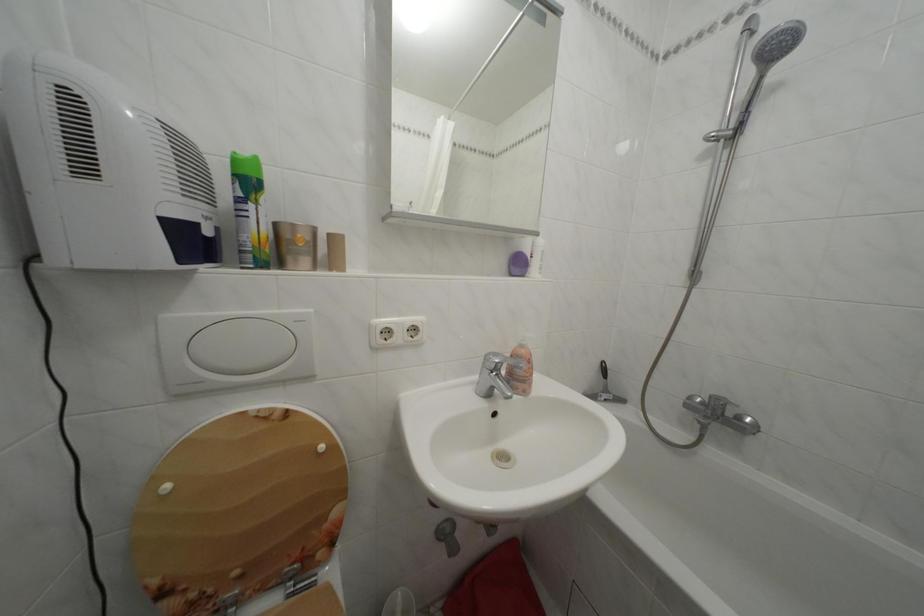
The image size is (924, 616). Identify the location of large flush button. (234, 349).